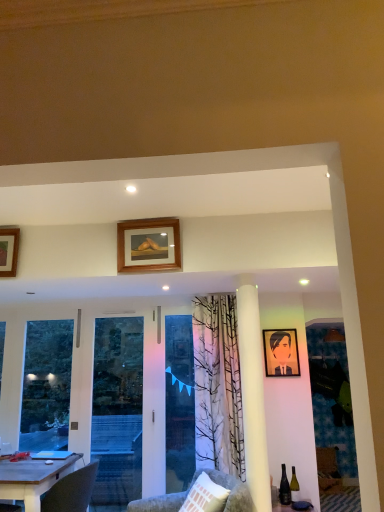
Question: Is velvet grey chair at lower center at the left side of transparent glass screen door at left?

Choices:
 (A) yes
 (B) no

Answer: (B)

Question: Is transparent glass screen door at left inside velvet grey chair at lower center?

Choices:
 (A) yes
 (B) no

Answer: (B)

Question: Can you confirm if velvet grey chair at lower center is taller than transparent glass screen door at left?

Choices:
 (A) no
 (B) yes

Answer: (A)

Question: Considering the relative positions of velvet grey chair at lower center and transparent glass screen door at left in the image provided, is velvet grey chair at lower center behind transparent glass screen door at left?

Choices:
 (A) yes
 (B) no

Answer: (B)

Question: Is velvet grey chair at lower center in contact with transparent glass screen door at left?

Choices:
 (A) no
 (B) yes

Answer: (A)

Question: From a real-world perspective, is velvet grey chair at lower center below transparent glass screen door at left?

Choices:
 (A) yes
 (B) no

Answer: (A)

Question: Does wooden picture frame at upper left, which ranks as the first picture frame in left-to-right order, have a greater width compared to velvet grey chair at lower center?

Choices:
 (A) no
 (B) yes

Answer: (A)

Question: Does wooden picture frame at upper left, the second picture frame viewed from the top, have a greater height compared to velvet grey chair at lower center?

Choices:
 (A) yes
 (B) no

Answer: (A)

Question: Does wooden picture frame at upper left, the 2th picture frame when ordered from front to back, have a lesser height compared to velvet grey chair at lower center?

Choices:
 (A) no
 (B) yes

Answer: (A)

Question: From the image's perspective, is wooden picture frame at upper left, the second picture frame viewed from the top, under velvet grey chair at lower center?

Choices:
 (A) no
 (B) yes

Answer: (A)

Question: Does wooden picture frame at upper left, the 2th picture frame when ordered from front to back, contain velvet grey chair at lower center?

Choices:
 (A) no
 (B) yes

Answer: (A)

Question: Is wooden picture frame at upper left, which ranks as the first picture frame in left-to-right order, next to velvet grey chair at lower center?

Choices:
 (A) no
 (B) yes

Answer: (A)

Question: From a real-world perspective, is matte glass wine bottle at lower right located beneath wooden portrait at center, the third picture frame in the front-to-back sequence?

Choices:
 (A) yes
 (B) no

Answer: (A)